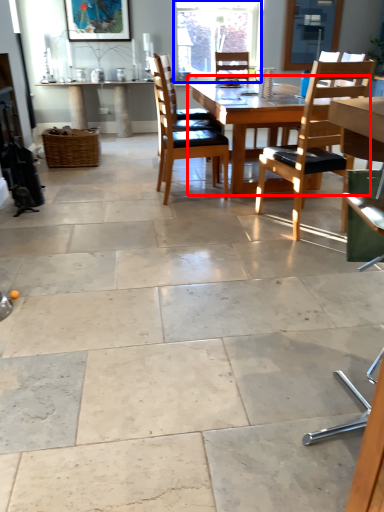
Question: Which object is closer to the camera taking this photo, kitchen & dining room table (highlighted by a red box) or window (highlighted by a blue box)?

Choices:
 (A) kitchen & dining room table
 (B) window

Answer: (A)